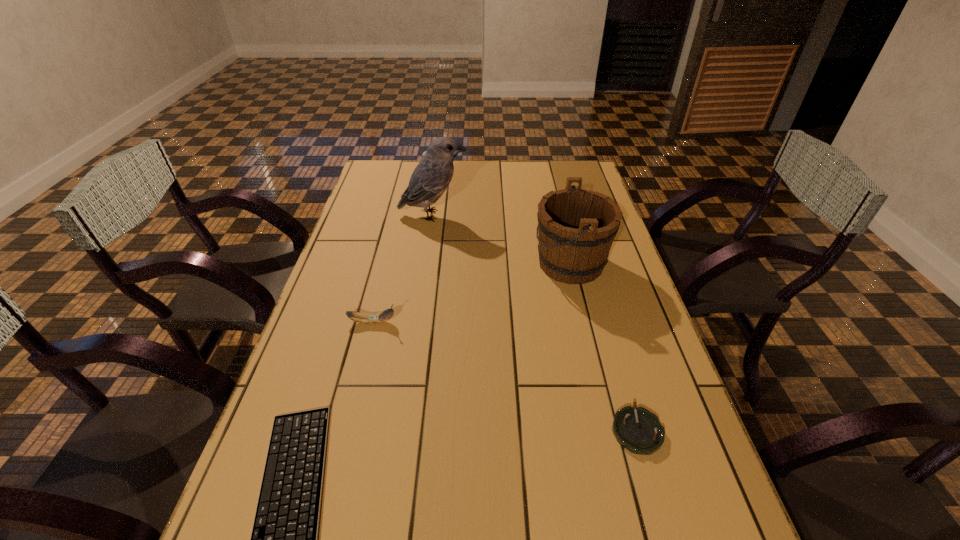
Find the location of a particular element. The image size is (960, 540). vacant area situated 0.110m on the side of the second tallest object with the handle for carrying is located at coordinates (498, 264).

Where is `vacant space located on the side of the second tallest object with the handle for carrying`? The height and width of the screenshot is (540, 960). vacant space located on the side of the second tallest object with the handle for carrying is located at coordinates (434, 264).

The width and height of the screenshot is (960, 540). I want to click on free location located 0.140m on the side of the second tallest object with the handle for carrying, so click(x=489, y=264).

The image size is (960, 540). In order to click on vacant area situated on the side of the third tallest object with the handle in this screenshot , I will do `click(424, 225)`.

Identify the location of vacant area situated at the stem of the banana. This screenshot has width=960, height=540. tap(426, 322).

I want to click on vacant space located 0.360m on the back of the second shortest object, so click(x=598, y=297).

You are a GUI agent. You are given a task and a screenshot of the screen. Output one action in this format:
    pyautogui.click(x=<x>, y=<y>)
    Task: Click on the object positioned at the far edge
    This screenshot has height=540, width=960.
    Given the screenshot: What is the action you would take?
    pyautogui.click(x=425, y=151)

In order to click on parrot at the left edge in this screenshot , I will do `click(431, 177)`.

I want to click on banana at the left edge, so click(370, 318).

Where is `wine bucket that is at the right edge`? The height and width of the screenshot is (540, 960). wine bucket that is at the right edge is located at coordinates (576, 228).